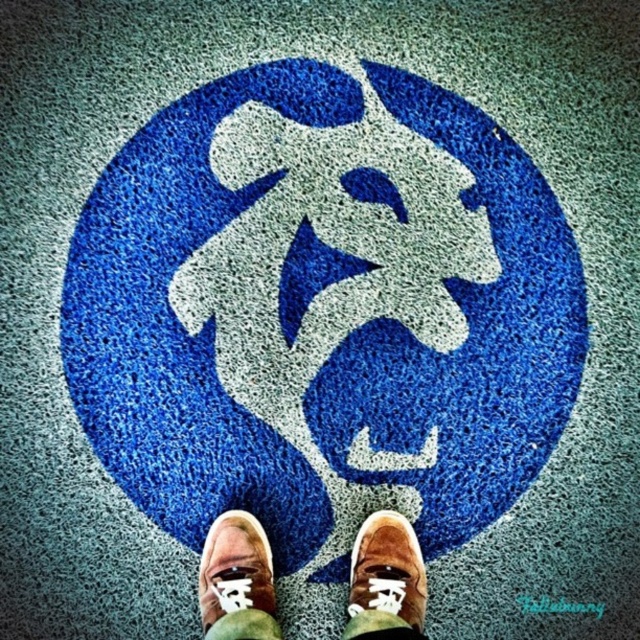
Question: Is blue textured carpet at center to the left of brown suede shoes at center from the viewer's perspective?

Choices:
 (A) no
 (B) yes

Answer: (A)

Question: Which object is farther from the camera taking this photo?

Choices:
 (A) brown suede shoe at lower center
 (B) blue textured carpet at center

Answer: (B)

Question: Which object appears farthest from the camera in this image?

Choices:
 (A) brown suede shoe at lower center
 (B) blue textured carpet at center
 (C) suede brown shoe at center

Answer: (B)

Question: Among these points, which one is farthest from the camera?

Choices:
 (A) (390, 564)
 (B) (340, 406)
 (C) (260, 616)
 (D) (388, 532)

Answer: (B)

Question: Is blue textured carpet at center above brown suede shoe at lower center?

Choices:
 (A) no
 (B) yes

Answer: (B)

Question: Is brown suede shoes at center further to camera compared to suede brown shoe at center?

Choices:
 (A) yes
 (B) no

Answer: (A)